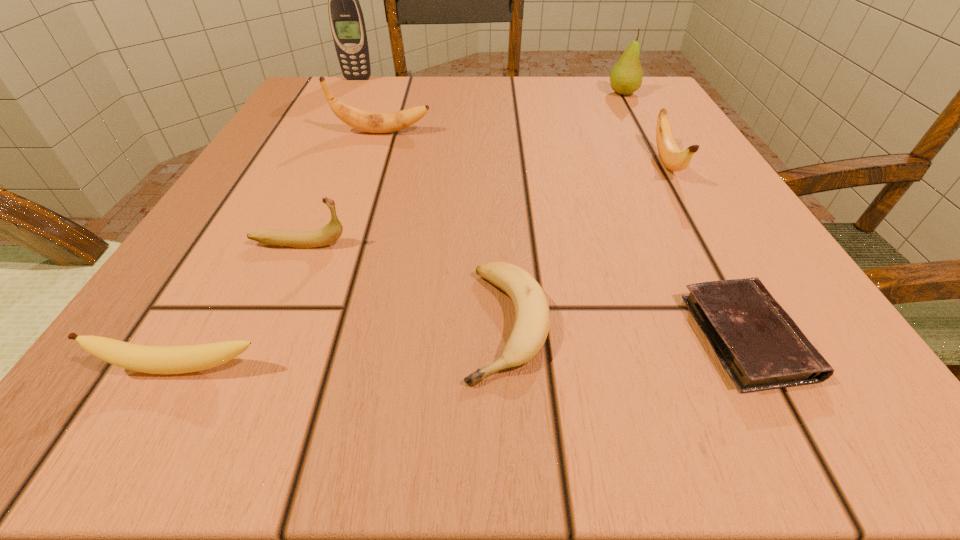
The height and width of the screenshot is (540, 960). I want to click on the tallest object, so click(347, 23).

I want to click on cellular telephone, so click(347, 23).

Find the location of a particular element. This screenshot has width=960, height=540. pear is located at coordinates (626, 76).

Identify the location of the second farthest object. (626, 76).

You are a GUI agent. You are given a task and a screenshot of the screen. Output one action in this format:
    pyautogui.click(x=<x>, y=<y>)
    Task: Click on the farthest banana
    This screenshot has height=540, width=960.
    Given the screenshot: What is the action you would take?
    pyautogui.click(x=361, y=120)

Locate an element on the screen. Image resolution: width=960 pixels, height=540 pixels. the third tallest object is located at coordinates (361, 120).

Find the location of a particular element. The width and height of the screenshot is (960, 540). the third farthest banana is located at coordinates (332, 231).

This screenshot has width=960, height=540. I want to click on the fourth farthest object, so click(x=674, y=159).

Find the location of a particular element. Image resolution: width=960 pixels, height=540 pixels. the rightmost banana is located at coordinates (674, 159).

Where is `the second shortest banana`? the second shortest banana is located at coordinates (189, 358).